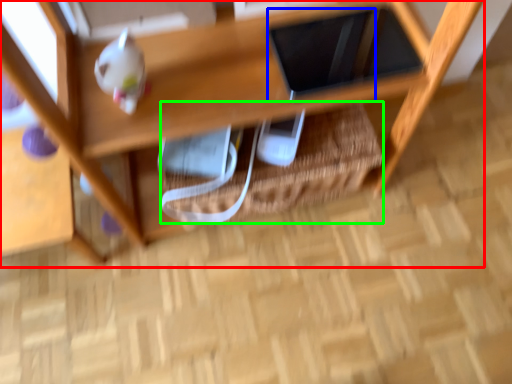
Question: Estimate the real-world distances between objects in this image. Which object is farther from shelf (highlighted by a red box), tablet computer (highlighted by a blue box) or basket (highlighted by a green box)?

Choices:
 (A) tablet computer
 (B) basket

Answer: (A)